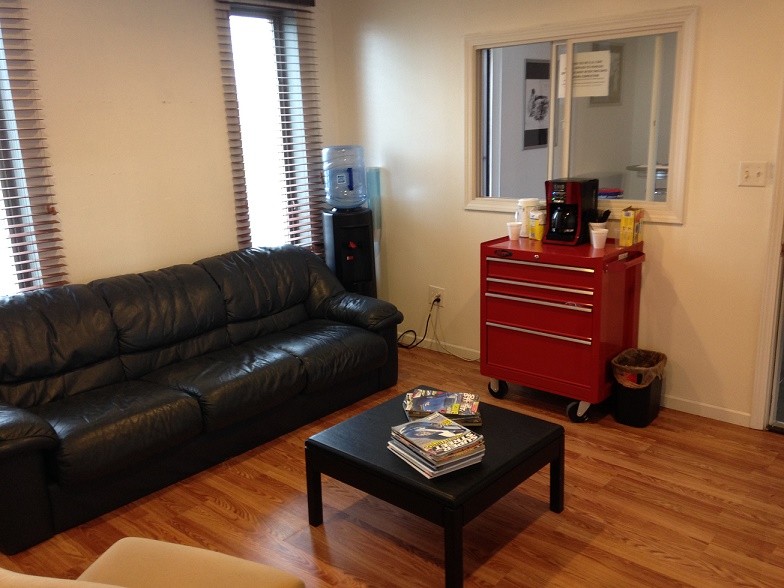
Find the location of a particular element. magazines is located at coordinates (461, 400), (437, 451).